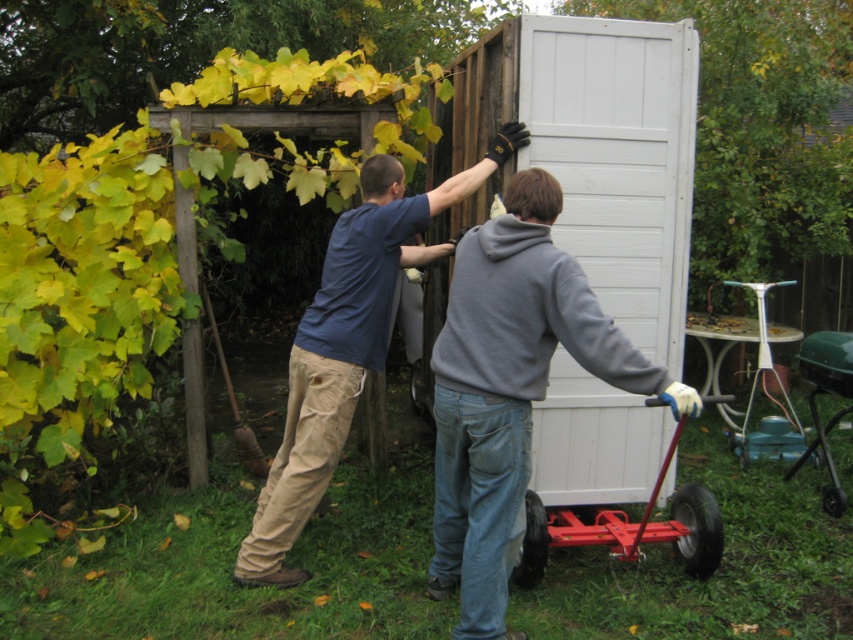
From the picture: Who is taller, gray fleece hoodie at center or blue cotton shirt at center?

With more height is blue cotton shirt at center.

Is point (474, 472) positioned after point (383, 256)?

No, (474, 472) is in front of (383, 256).

Is point (543, 397) positioned after point (376, 216)?

That is False.

In order to click on gray fleece hoodie at center in this screenshot , I will do `click(511, 388)`.

Locate an element on the screen. gray fleece hoodie at center is located at coordinates (511, 388).

Does gray fleece hoodie at center appear under metallic red wagon at lower center?

No, gray fleece hoodie at center is not below metallic red wagon at lower center.

Does point (519, 280) lie behind point (653, 500)?

That is False.

Image resolution: width=853 pixels, height=640 pixels. I want to click on gray fleece hoodie at center, so click(x=511, y=388).

Does blue cotton shirt at center come in front of metallic red wagon at lower center?

No, blue cotton shirt at center is further to the viewer.

Is point (334, 419) in front of point (706, 518)?

Yes.

Is point (260, 577) positioned behind point (596, 518)?

That is False.

This screenshot has height=640, width=853. What are the coordinates of `blue cotton shirt at center` in the screenshot? It's located at (346, 344).